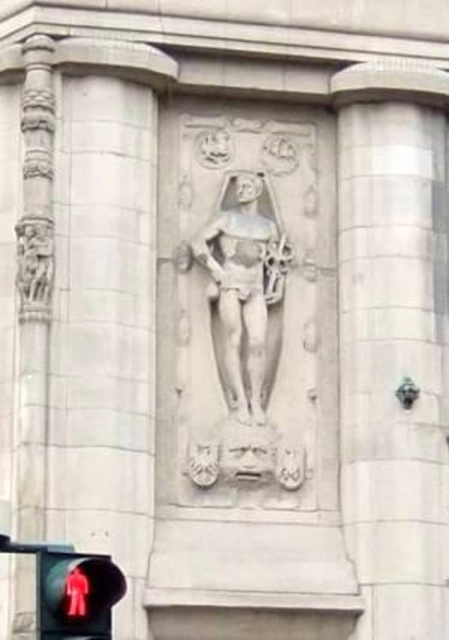
Question: Which object is positioned farthest from the red glass pedestrian at lower left?

Choices:
 (A) white stone figure at center
 (B) white stone pillar at center

Answer: (B)

Question: Is white stone pillar at center bigger than white stone figure at center?

Choices:
 (A) no
 (B) yes

Answer: (B)

Question: Is white stone pillar at center below red glass pedestrian at lower left?

Choices:
 (A) yes
 (B) no

Answer: (B)

Question: Which object appears farthest from the camera in this image?

Choices:
 (A) white stone figure at center
 (B) red glass pedestrian at lower left

Answer: (A)

Question: Can you confirm if white stone pillar at center is positioned to the right of white stone figure at center?

Choices:
 (A) no
 (B) yes

Answer: (B)

Question: Which of the following is the closest to the observer?

Choices:
 (A) white stone pillar at center
 (B) white stone figure at center
 (C) red glass pedestrian at lower left

Answer: (C)